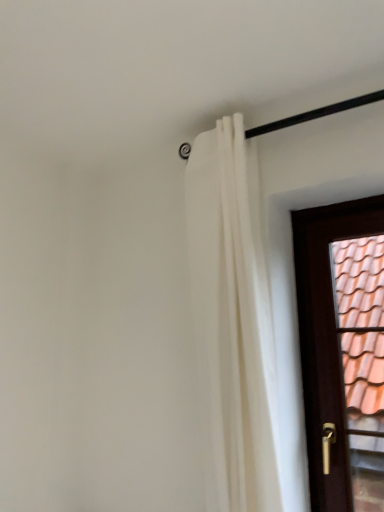
Question: From the image's perspective, is white fabric curtain at upper center on top of brown wooden door at right?

Choices:
 (A) yes
 (B) no

Answer: (A)

Question: Considering the relative sizes of white fabric curtain at upper center and brown wooden door at right in the image provided, is white fabric curtain at upper center smaller than brown wooden door at right?

Choices:
 (A) no
 (B) yes

Answer: (A)

Question: Considering the relative positions of white fabric curtain at upper center and brown wooden door at right in the image provided, is white fabric curtain at upper center behind brown wooden door at right?

Choices:
 (A) no
 (B) yes

Answer: (A)

Question: From the image's perspective, is white fabric curtain at upper center beneath brown wooden door at right?

Choices:
 (A) no
 (B) yes

Answer: (A)

Question: Is white fabric curtain at upper center positioned in front of brown wooden door at right?

Choices:
 (A) yes
 (B) no

Answer: (A)

Question: Is brown wooden door at right at the back of white fabric curtain at upper center?

Choices:
 (A) no
 (B) yes

Answer: (A)

Question: Is brown wooden door at right taller than white fabric curtain at upper center?

Choices:
 (A) no
 (B) yes

Answer: (A)

Question: Would you say white fabric curtain at upper center is part of brown wooden door at right's contents?

Choices:
 (A) yes
 (B) no

Answer: (B)

Question: From a real-world perspective, is brown wooden door at right over white fabric curtain at upper center?

Choices:
 (A) no
 (B) yes

Answer: (A)

Question: Is brown wooden door at right next to white fabric curtain at upper center?

Choices:
 (A) no
 (B) yes

Answer: (A)

Question: Considering the relative positions of brown wooden door at right and white fabric curtain at upper center in the image provided, is brown wooden door at right behind white fabric curtain at upper center?

Choices:
 (A) no
 (B) yes

Answer: (B)

Question: Is white fabric curtain at upper center at the back of brown wooden door at right?

Choices:
 (A) yes
 (B) no

Answer: (B)

Question: Considering the positions of brown wooden door at right and white fabric curtain at upper center in the image, is brown wooden door at right wider or thinner than white fabric curtain at upper center?

Choices:
 (A) wide
 (B) thin

Answer: (B)